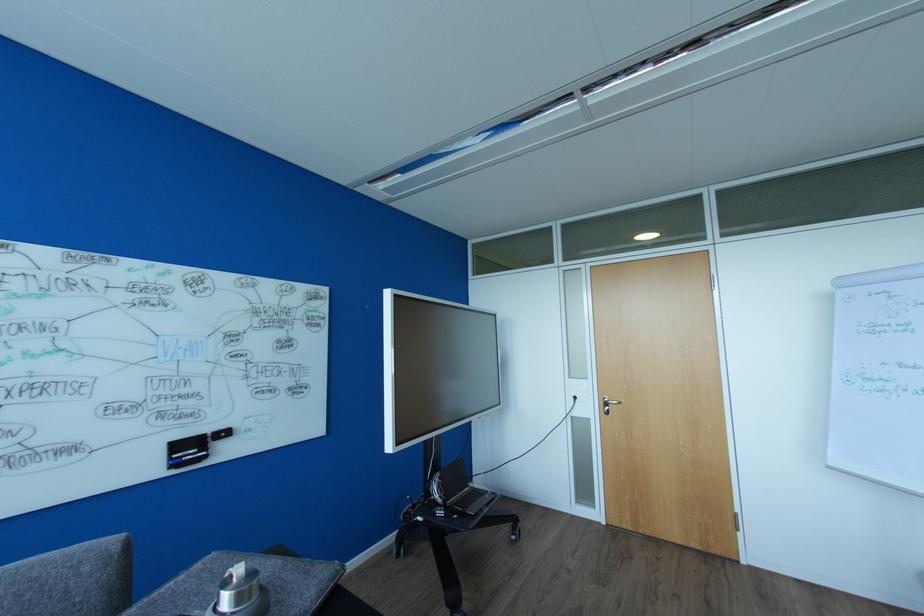
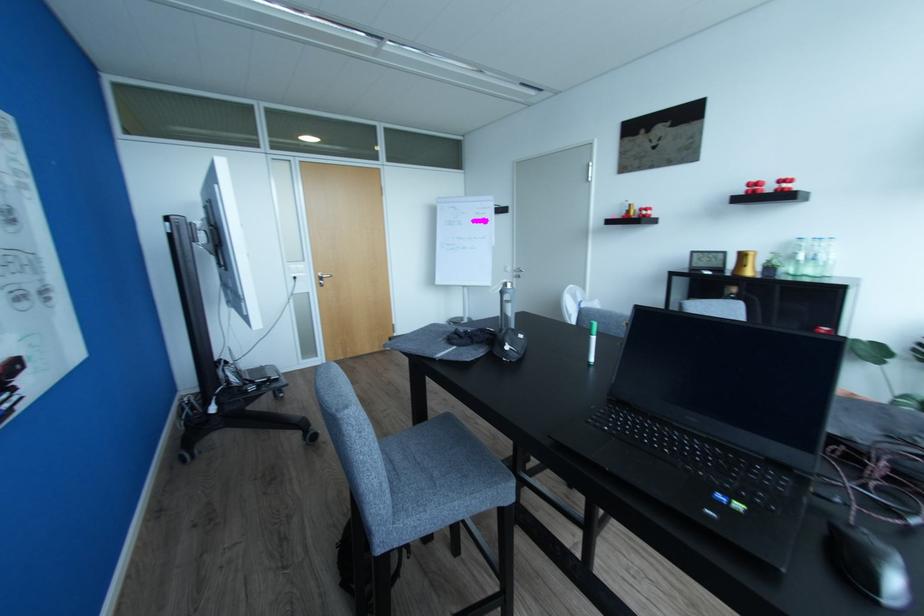
Find the pixel in the second image that matches the point at 610,403 in the first image.

(324, 278)